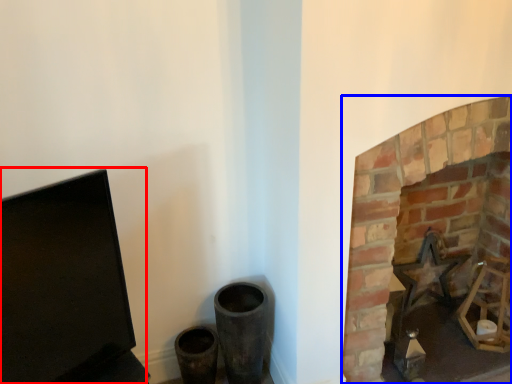
Question: Which object is closer to the camera taking this photo, computer monitor (highlighted by a red box) or fireplace (highlighted by a blue box)?

Choices:
 (A) computer monitor
 (B) fireplace

Answer: (A)